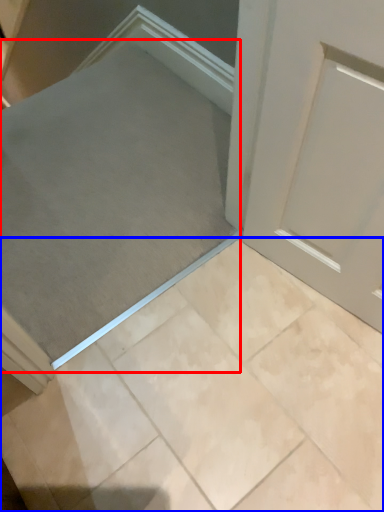
Question: Which object is further to the camera taking this photo, ramp (highlighted by a red box) or ceramic tile (highlighted by a blue box)?

Choices:
 (A) ramp
 (B) ceramic tile

Answer: (A)